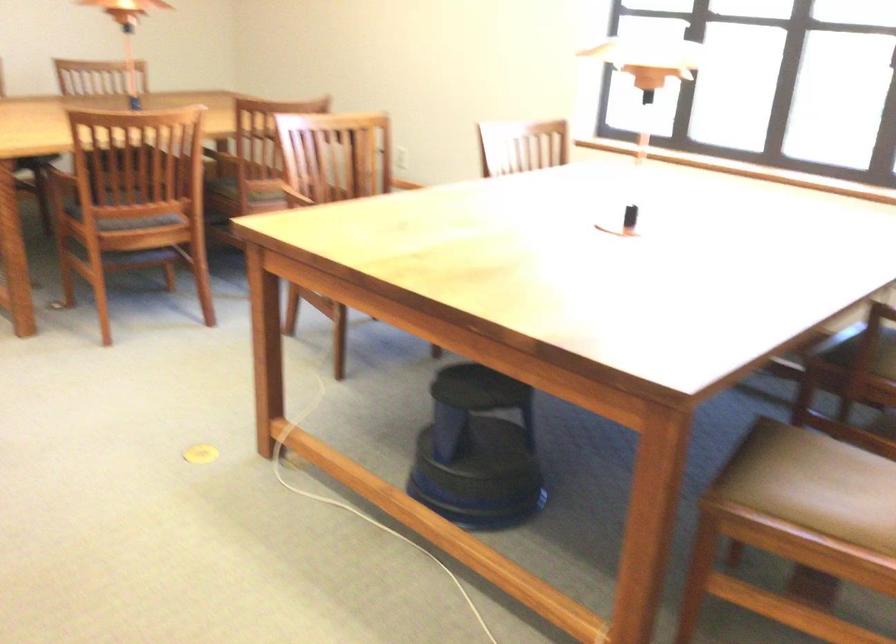
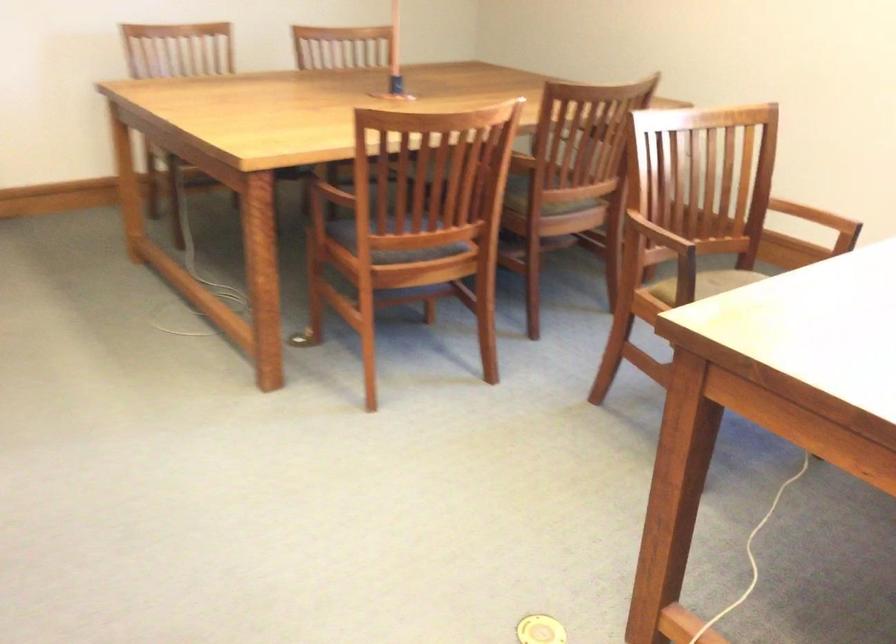
Looking at this image, which direction would the cameraman need to move to produce the second image?

The cameraman walked toward left, forward.